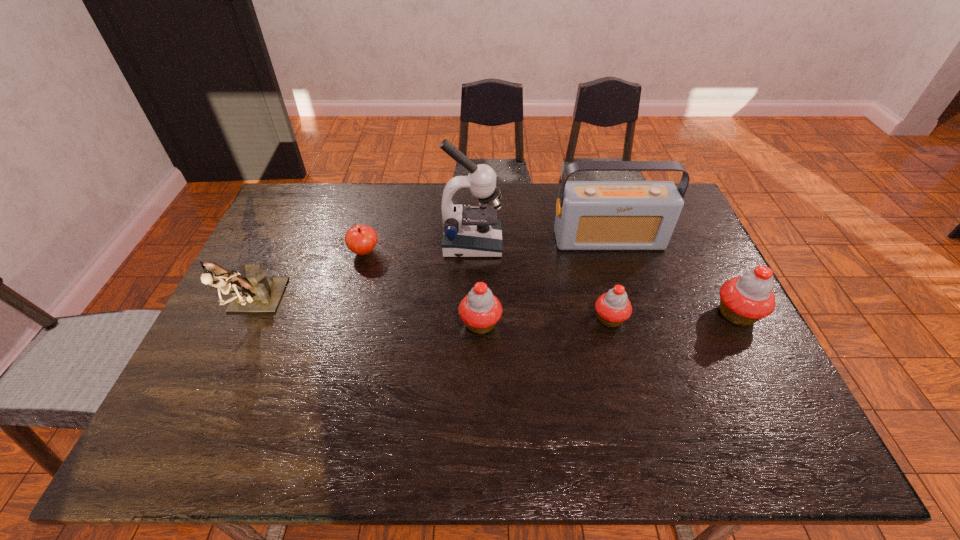
Observe the arrangement of all cupcakes in the image. To keep them evenly spaced, where would you place another cupcake on the left? Please locate a free space. Please provide its 2D coordinates. Your answer should be formatted as a tuple, i.e. [(x, y)], where the tuple contains the x and y coordinates of a point satisfying the conditions above.

[(348, 328)]